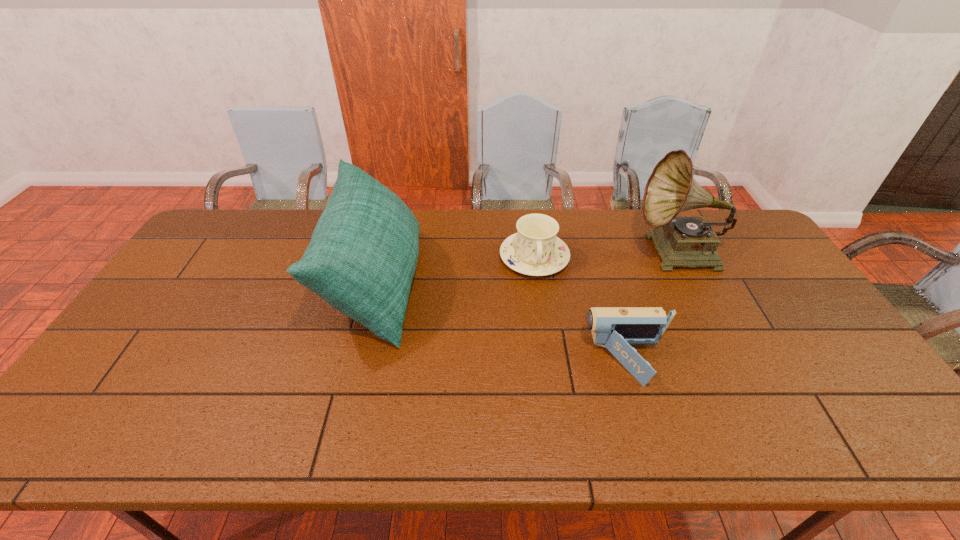
Identify the location of vacant space at the right edge. Image resolution: width=960 pixels, height=540 pixels. (814, 328).

You are a GUI agent. You are given a task and a screenshot of the screen. Output one action in this format:
    pyautogui.click(x=<x>, y=<y>)
    Task: Click on the free point at the far right corner
    This screenshot has height=540, width=960.
    Given the screenshot: What is the action you would take?
    pyautogui.click(x=726, y=245)

Image resolution: width=960 pixels, height=540 pixels. Identify the location of vacant space that is in between the chinaware and the record player. (606, 256).

Identify the location of vacant area that lies between the chinaware and the third shortest object. (455, 270).

Find the location of a particular element. The image size is (960, 540). vacant area that lies between the camcorder and the chinaware is located at coordinates (582, 309).

At what (x,y) coordinates should I click in order to perform the action: click on free space between the camcorder and the cushion. Please return your answer as a coordinate pair (x, y). This screenshot has height=540, width=960. Looking at the image, I should click on (502, 322).

What are the coordinates of `object identified as the third closest to the camcorder` in the screenshot? It's located at (363, 253).

Point out which object is positioned as the third nearest to the leftmost object. Please provide its 2D coordinates. Your answer should be formatted as a tuple, i.e. [(x, y)], where the tuple contains the x and y coordinates of a point satisfying the conditions above.

[(680, 241)]

Where is `free location that satisfies the following two spatial constraints: 1. on the handle side of the chinaware; 2. on the front-facing side of the cushion`? The width and height of the screenshot is (960, 540). free location that satisfies the following two spatial constraints: 1. on the handle side of the chinaware; 2. on the front-facing side of the cushion is located at coordinates (538, 283).

Locate an element on the screen. The height and width of the screenshot is (540, 960). vacant space that satisfies the following two spatial constraints: 1. on the handle side of the chinaware; 2. on the front-facing side of the leftmost object is located at coordinates (538, 283).